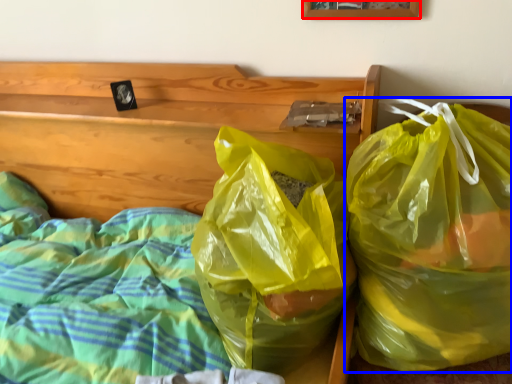
Question: Which point is closer to the camera, picture frame (highlighted by a red box) or plastic bag (highlighted by a blue box)?

Choices:
 (A) picture frame
 (B) plastic bag

Answer: (B)